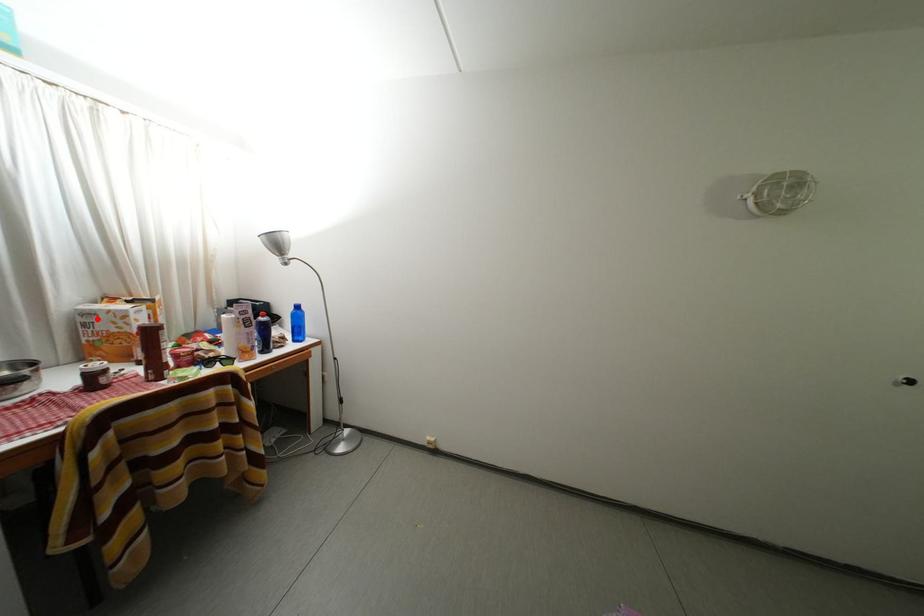
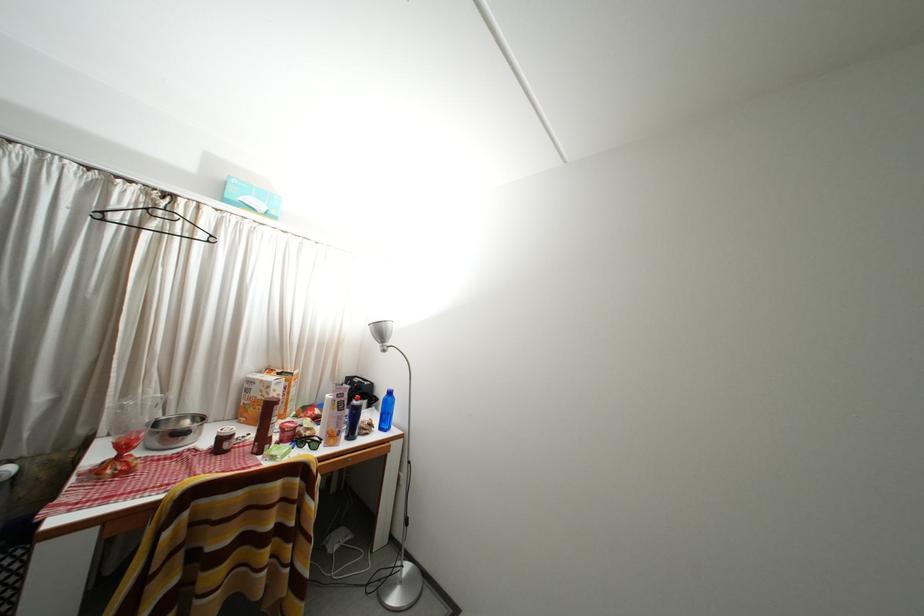
Question: I am providing you with two images of the same scene from different viewpoints. A red point is marked on the first image. Is the red point's position out of view in image 2?

Choices:
 (A) Yes
 (B) No

Answer: (B)